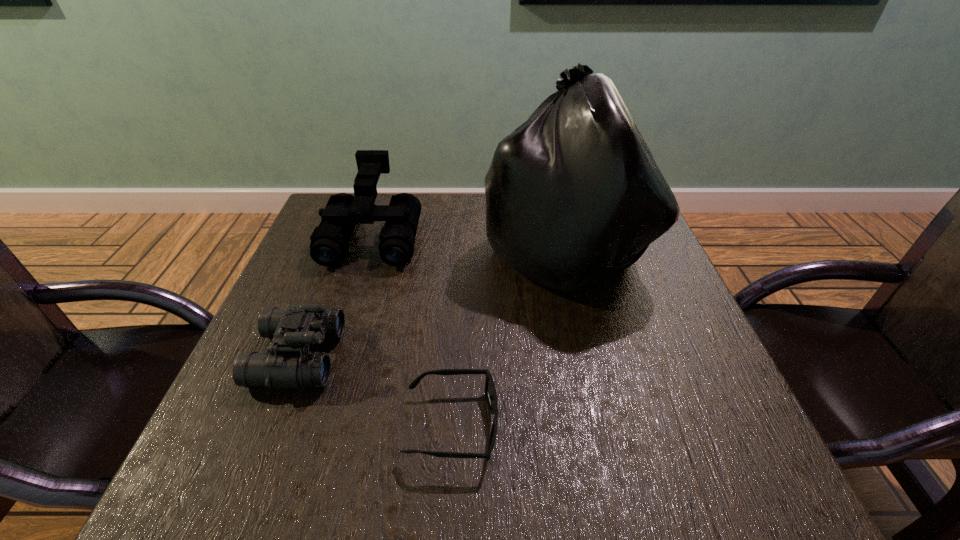
The width and height of the screenshot is (960, 540). I want to click on the closest object relative to the shortest object, so click(290, 365).

Identify the location of the third closest object to the second tallest object. The image size is (960, 540). (490, 391).

At what (x,y) coordinates should I click in order to perform the action: click on vacant area that satisfies the following two spatial constraints: 1. on the front lenses of the taller binoculars; 2. on the left side of the plastic bag. Please return your answer as a coordinate pair (x, y). The height and width of the screenshot is (540, 960). Looking at the image, I should click on (369, 249).

Image resolution: width=960 pixels, height=540 pixels. I want to click on free location that satisfies the following two spatial constraints: 1. on the front lenses of the second tallest object; 2. through the lenses of the third tallest object, so pyautogui.click(x=335, y=356).

Where is `vacant space that satisfies the following two spatial constraints: 1. on the front lenses of the tallest object; 2. on the left side of the taller binoculars`? This screenshot has width=960, height=540. vacant space that satisfies the following two spatial constraints: 1. on the front lenses of the tallest object; 2. on the left side of the taller binoculars is located at coordinates (369, 249).